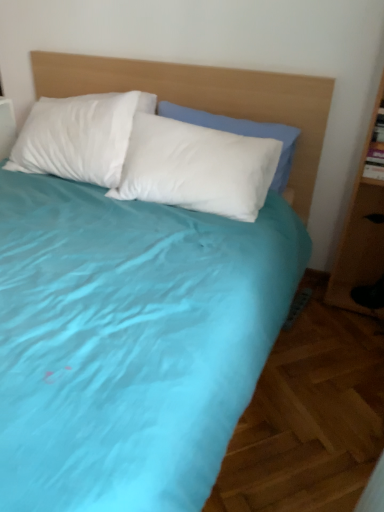
Question: Is white soft pillow at center next to wooden headboard at upper center and touching it?

Choices:
 (A) no
 (B) yes

Answer: (A)

Question: Does white soft pillow at center have a lesser width compared to wooden headboard at upper center?

Choices:
 (A) yes
 (B) no

Answer: (A)

Question: Is the depth of white soft pillow at center greater than that of wooden headboard at upper center?

Choices:
 (A) yes
 (B) no

Answer: (A)

Question: Is white soft pillow at center at the right side of wooden headboard at upper center?

Choices:
 (A) yes
 (B) no

Answer: (A)

Question: Is wooden headboard at upper center completely or partially inside white soft pillow at center?

Choices:
 (A) yes
 (B) no

Answer: (B)

Question: From the image's perspective, is white soft pillow at center over wooden headboard at upper center?

Choices:
 (A) yes
 (B) no

Answer: (A)

Question: Considering the relative sizes of wooden headboard at upper center and white soft pillow at center in the image provided, is wooden headboard at upper center thinner than white soft pillow at center?

Choices:
 (A) no
 (B) yes

Answer: (A)

Question: Is the position of wooden headboard at upper center more distant than that of white soft pillow at center?

Choices:
 (A) no
 (B) yes

Answer: (A)

Question: Is wooden headboard at upper center closer to the viewer compared to white soft pillow at center?

Choices:
 (A) yes
 (B) no

Answer: (A)

Question: Is wooden headboard at upper center to the right of white soft pillow at center from the viewer's perspective?

Choices:
 (A) no
 (B) yes

Answer: (A)

Question: Is white soft pillow at center inside wooden headboard at upper center?

Choices:
 (A) no
 (B) yes

Answer: (B)

Question: Is wooden headboard at upper center far away from white soft pillow at center?

Choices:
 (A) no
 (B) yes

Answer: (A)

Question: In the image, is white soft pillow at center on the left side or the right side of wooden headboard at upper center?

Choices:
 (A) right
 (B) left

Answer: (A)